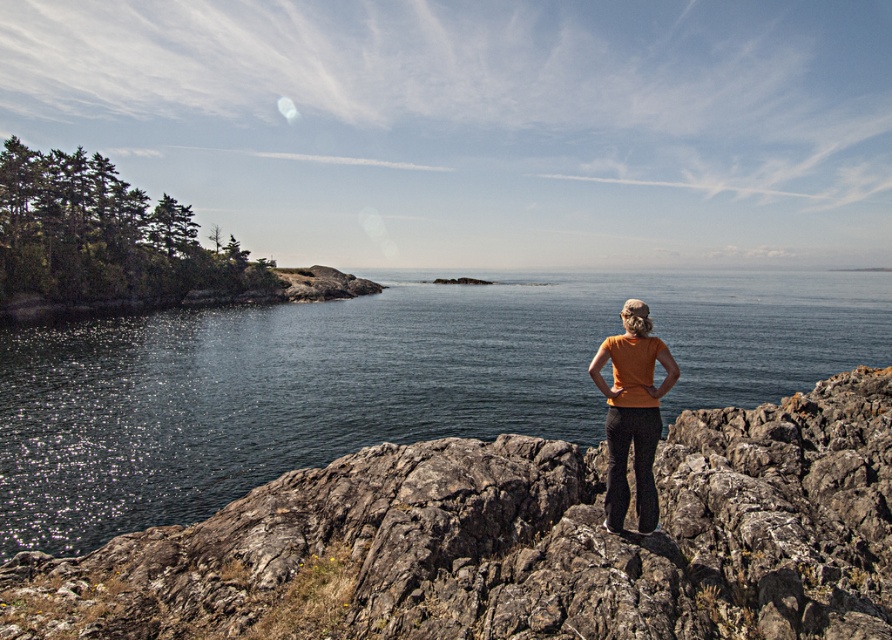
Does point (527, 576) lie in front of point (624, 362)?

Yes, point (527, 576) is in front of point (624, 362).

Does rough textured rock at center have a smaller size compared to orange cotton shirt at center?

Incorrect, rough textured rock at center is not smaller in size than orange cotton shirt at center.

You are a GUI agent. You are given a task and a screenshot of the screen. Output one action in this format:
    pyautogui.click(x=<x>, y=<y>)
    Task: Click on the rough textured rock at center
    This screenshot has width=892, height=640.
    Given the screenshot: What is the action you would take?
    pyautogui.click(x=518, y=541)